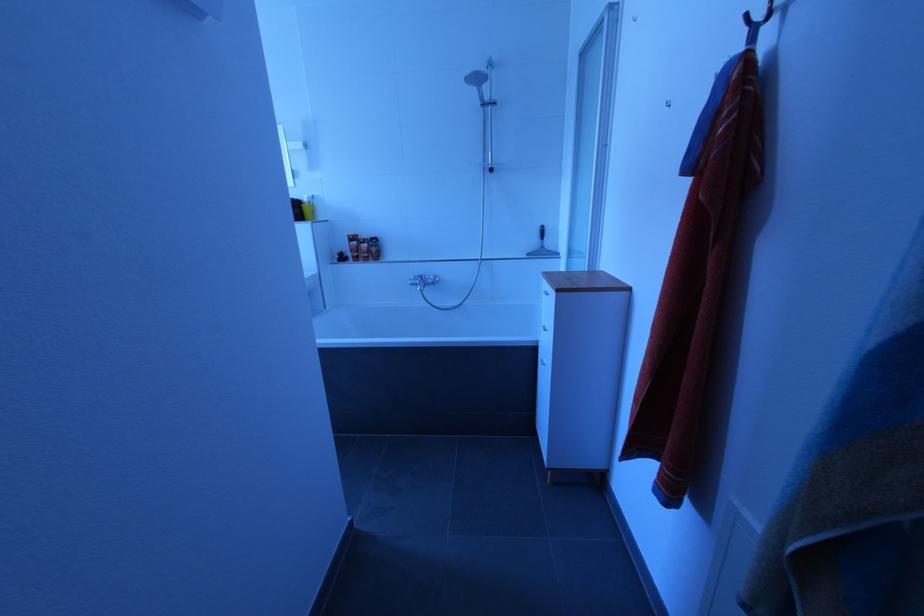
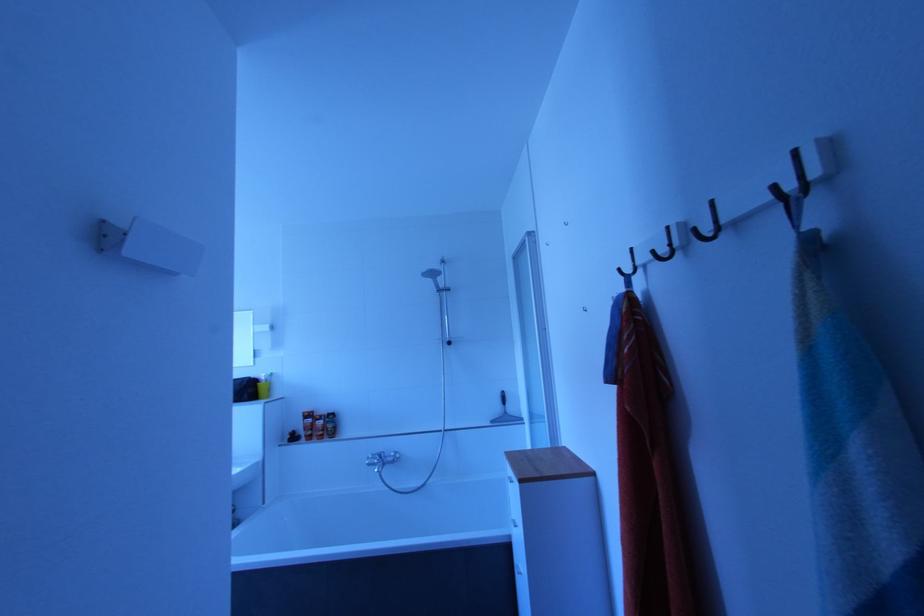
In a continuous first-person perspective shot, in which direction is the camera moving?

The cameraman moved toward right, backward.